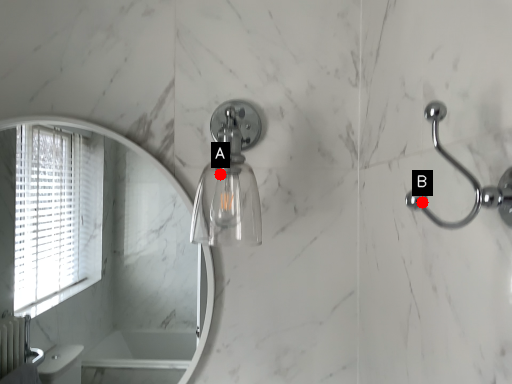
Question: Two points are circled on the image, labeled by A and B beside each circle. Which of the following is the closest to the observer?

Choices:
 (A) A is closer
 (B) B is closer

Answer: (B)